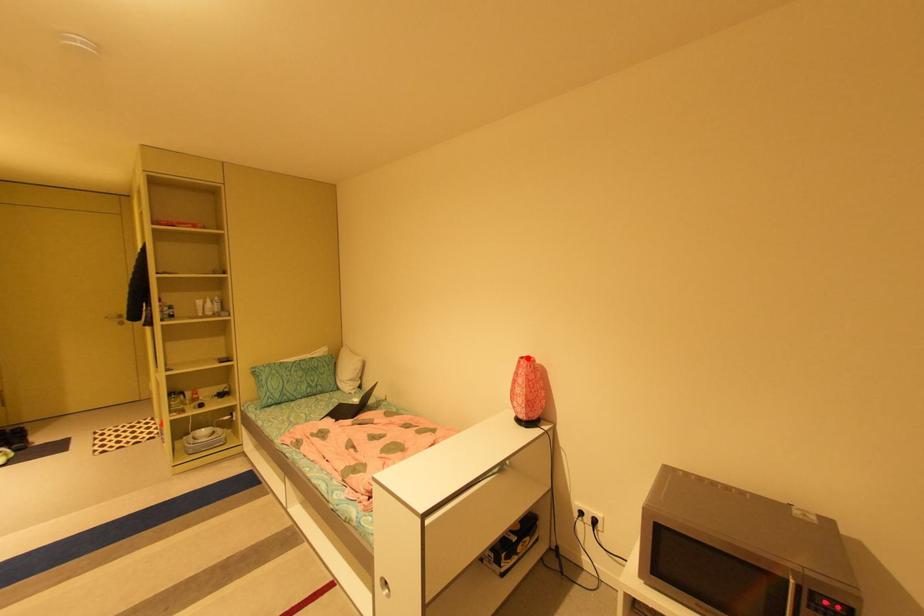
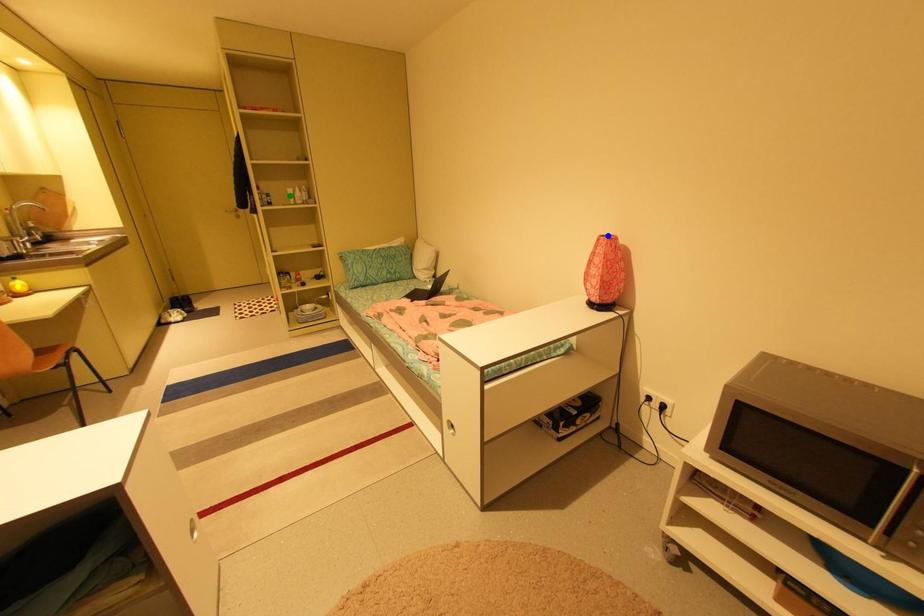
Question: I am providing you with two images of the same scene from different viewpoints. A red point is marked on the first image. You are given multiple points on the second image. Which mark in image 2 goes with the point in image 1?

Choices:
 (A) yellow point
 (B) green point
 (C) blue point

Answer: (C)